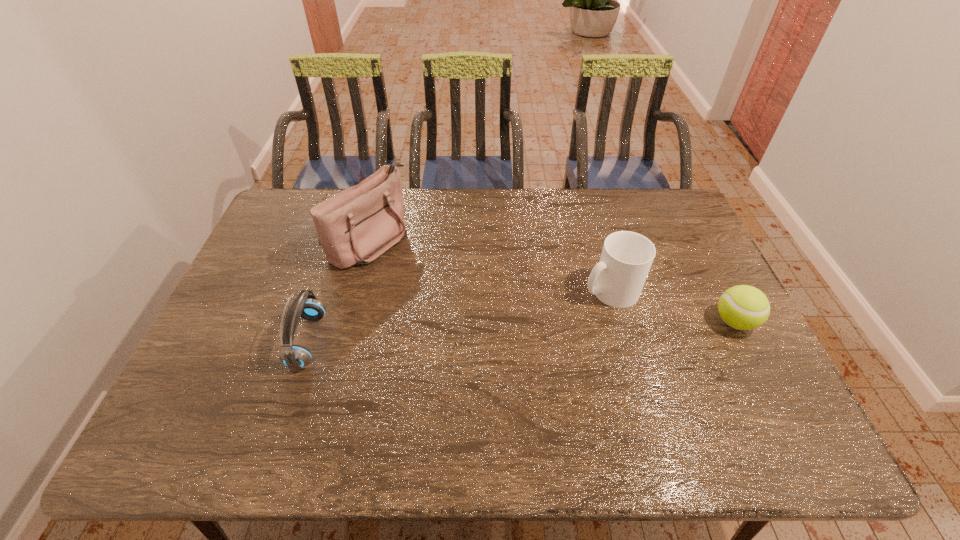
Find the location of a particular element. free space on the desktop that is between the third tallest object and the shortest object and is positioned on the front pocket of the shoulder bag is located at coordinates (536, 331).

Image resolution: width=960 pixels, height=540 pixels. I want to click on free spot on the desktop that is between the second shortest object and the shortest object and is positioned on the handle side of the second object from right to left, so click(547, 330).